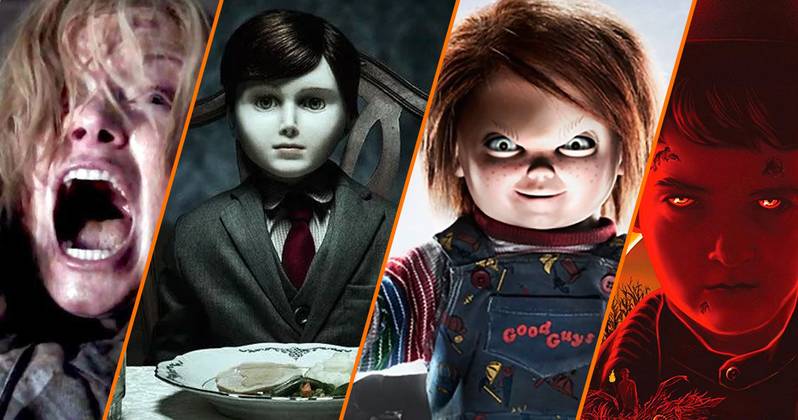
Where is `table`? The height and width of the screenshot is (420, 798). table is located at coordinates (159, 407).